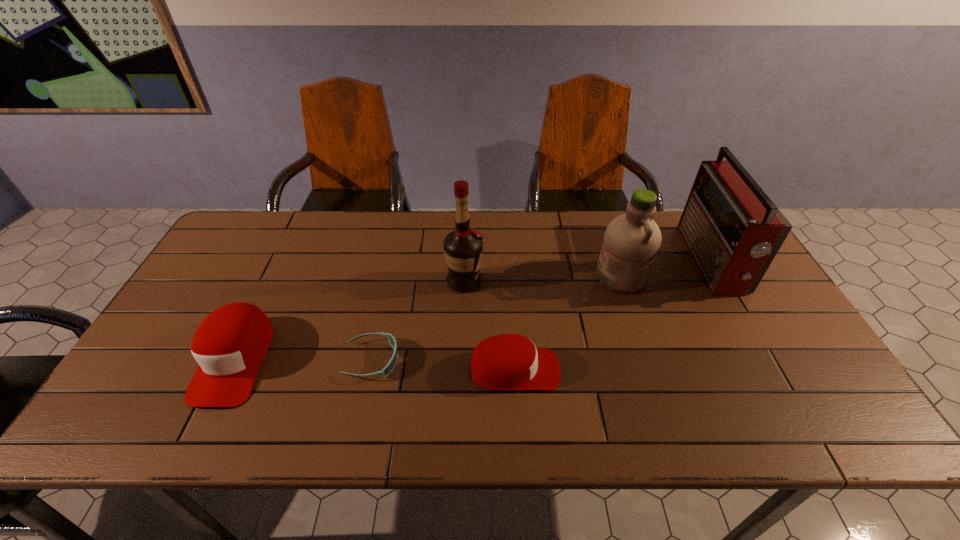
Observe the arrangement of all baseball caps in the image. To keep them evenly spaced, where would you place another baseball cap on the right? Please locate a free space. Please provide its 2D coordinates. Your answer should be formatted as a tuple, i.e. [(x, y)], where the tuple contains the x and y coordinates of a point satisfying the conditions above.

[(805, 381)]